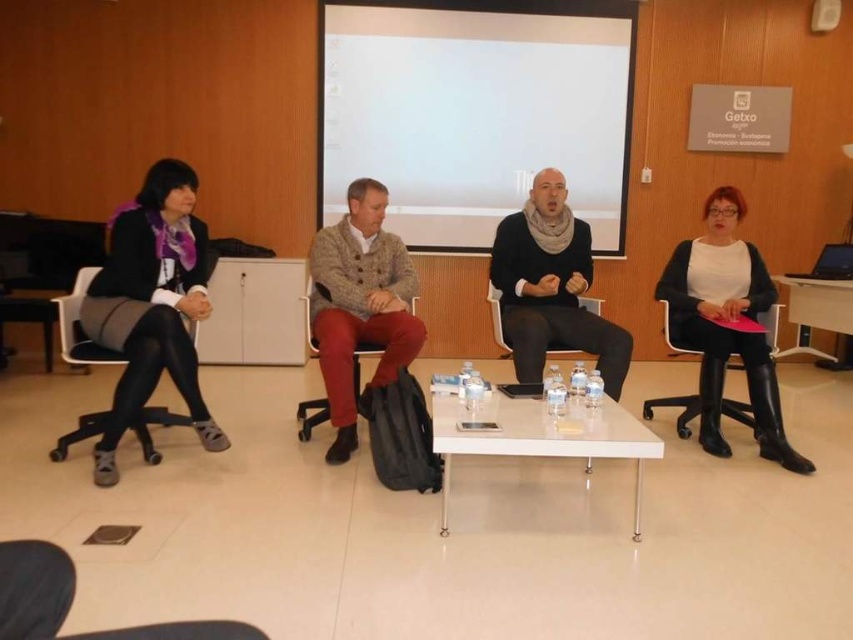
Locate an element on the screen. This screenshot has height=640, width=853. knit sweater at center is located at coordinates (550, 288).

Is point (566, 221) farther from camera compared to point (537, 426)?

Yes, point (566, 221) is behind point (537, 426).

At what (x,y) coordinates should I click in order to perform the action: click on knit sweater at center. Please return your answer as a coordinate pair (x, y). Looking at the image, I should click on (550, 288).

Does point (590, 273) lie in front of point (357, 352)?

No, it is not.

Who is more forward, (x=624, y=337) or (x=379, y=346)?

Point (x=624, y=337)

Locate an element on the screen. knit sweater at center is located at coordinates (550, 288).

The image size is (853, 640). Describe the element at coordinates (151, 305) in the screenshot. I see `matte black jacket at left` at that location.

Between matte black jacket at left and black leather boots at right, which one is positioned higher?

matte black jacket at left

This screenshot has height=640, width=853. Describe the element at coordinates (151, 305) in the screenshot. I see `matte black jacket at left` at that location.

Where is `matte black jacket at left`? Image resolution: width=853 pixels, height=640 pixels. matte black jacket at left is located at coordinates (151, 305).